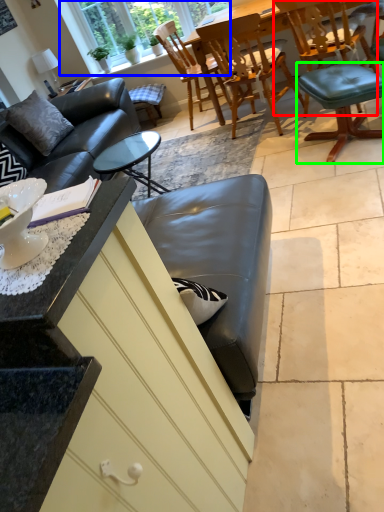
Question: Which is farther away from chair (highlighted by a red box)? window (highlighted by a blue box) or bar stool (highlighted by a green box)?

Choices:
 (A) window
 (B) bar stool

Answer: (A)